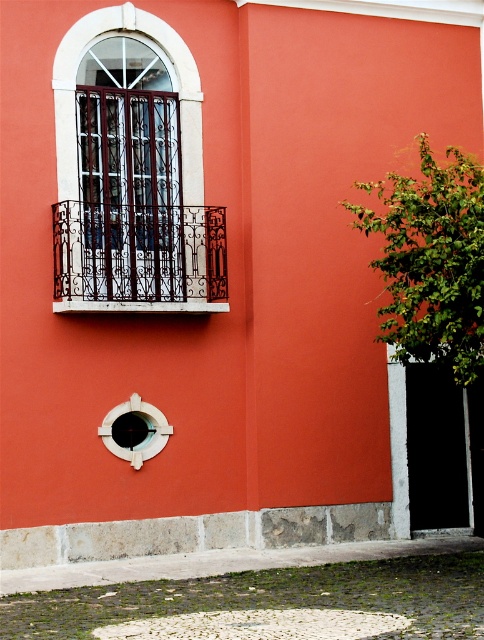
You are standing in front of the building and notice two features on the wall. The white wrought iron balcony at upper left and the white plastic hole at lower center. Which one is positioned to the right side of the other?

The white wrought iron balcony at upper left is to the right of the white plastic hole at lower center.

You are an architect designing a new building inspired by this image. You need to ensure that the white wrought iron balcony at upper left and the smooth white circle at center are proportionally scaled. Which object should be wider to maintain the design balance?

The white wrought iron balcony at upper left should be wider than the smooth white circle at center to maintain the design balance, as its width surpasses the smooth white circle at center according to the description.

You are standing in front of a building with a vibrant orange wall. There is a round window near the bottom center and a decorative rectangular window above it with metal bars. You notice a point marked at coordinates [138,257]. Which object does this point correspond to?

The point at coordinates [138,257] corresponds to the white wrought iron balcony at upper left.